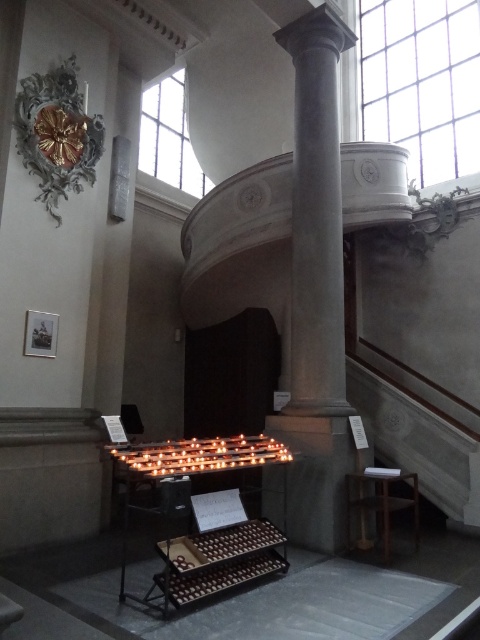
In the scene shown: You are an architect examining the church interior. You need to place a new decorative item that requires a stable base. Which object, the smooth gray column at center or the brown wooden stool at lower right, would be more suitable for placing the item?

The smooth gray column at center is larger in size than the brown wooden stool at lower right, making it more stable and suitable for placing the decorative item.

You are a visitor in the church and want to take a photo of the brown wooden stool at lower right without the smooth gray column at center blocking the view. Is this possible from your current position?

The brown wooden stool at lower right is behind the smooth gray column at center, so it is already blocked by the column. You would need to move to a position where the stool is not behind the column to take an unobstructed photo.